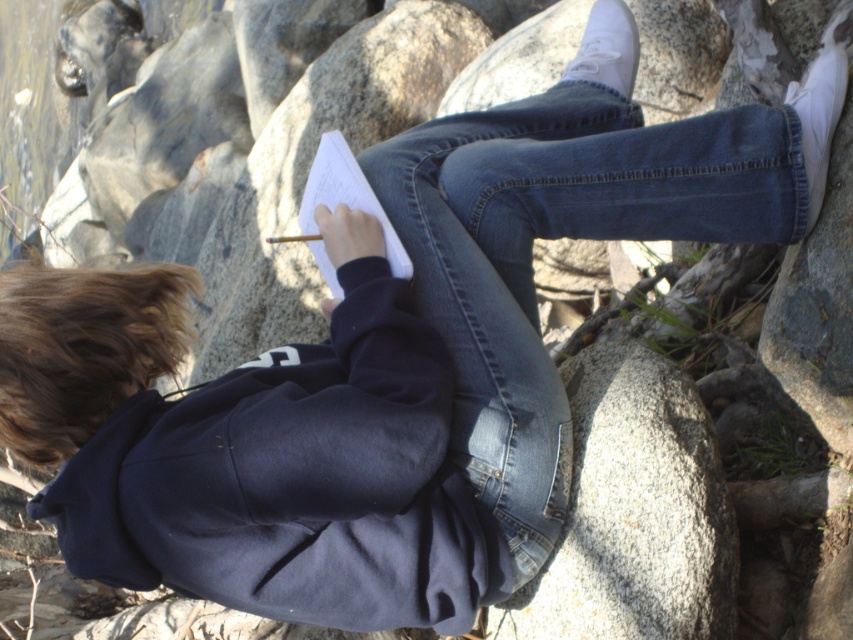
Question: Estimate the real-world distances between objects in this image. Which object is farther from the brown fuzzy hair at upper left?

Choices:
 (A) white paper at center
 (B) denim at center

Answer: (B)

Question: Does denim at center appear over white paper at center?

Choices:
 (A) no
 (B) yes

Answer: (B)

Question: Estimate the real-world distances between objects in this image. Which object is farther from the denim at center?

Choices:
 (A) white paper at center
 (B) brown fuzzy hair at upper left

Answer: (B)

Question: Among these points, which one is nearest to the camera?

Choices:
 (A) (187, 268)
 (B) (595, 150)

Answer: (B)

Question: Can you confirm if brown fuzzy hair at upper left is positioned to the left of white paper at center?

Choices:
 (A) yes
 (B) no

Answer: (A)

Question: Where is denim at center located in relation to brown fuzzy hair at upper left in the image?

Choices:
 (A) right
 (B) left

Answer: (A)